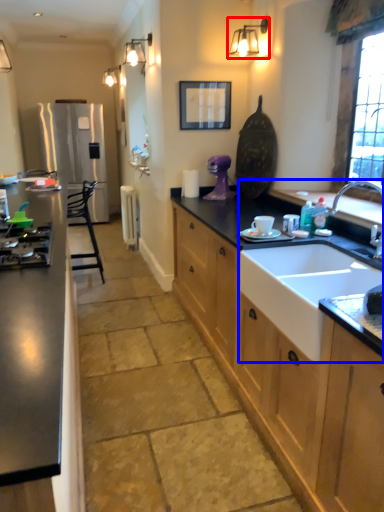
Question: Which object is further to the camera taking this photo, light fixture (highlighted by a red box) or sink (highlighted by a blue box)?

Choices:
 (A) light fixture
 (B) sink

Answer: (A)